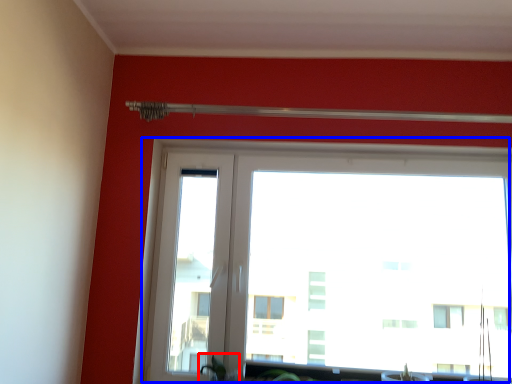
Question: Which point is closer to the camera, plant (highlighted by a red box) or window (highlighted by a blue box)?

Choices:
 (A) plant
 (B) window

Answer: (A)